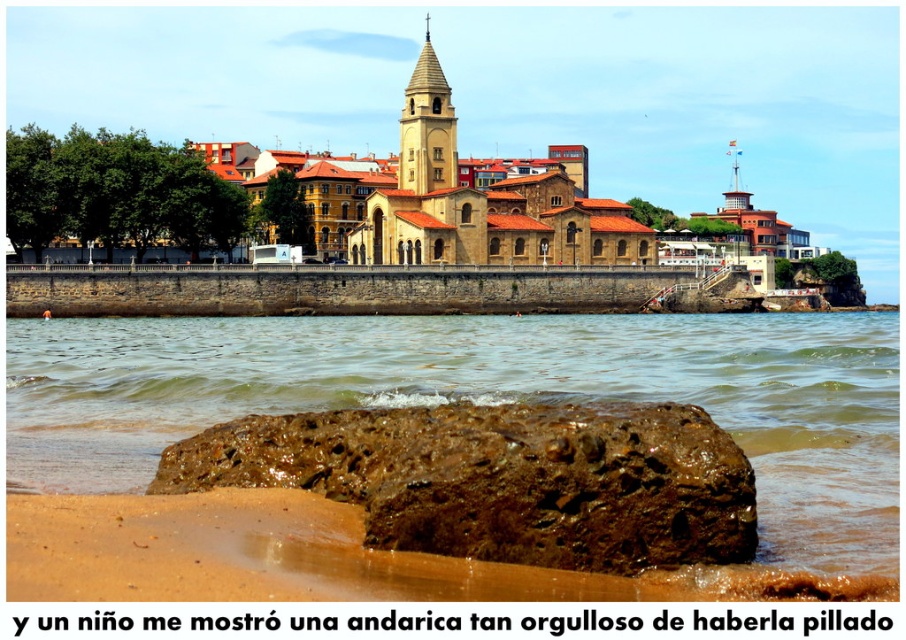
You are standing at the edge of the beach looking towards the historic church. Where exactly is the brown wet sand at lower center located in relation to your position?

The brown wet sand at lower center is located at point [487,396] relative to your position.

You are standing at the point with coordinates point (423, 64) and want to walk towards the point with coordinates point (58, 320). Based on the scene description, will you have to walk over the historic church or can you walk directly to your destination?

You can walk directly to the point (58, 320) without walking over the historic church because point (58, 320) is in front of point (423, 64), implying it is closer to the viewer and likely in the foreground where the sandy beach and shallow water are located, while the church is in the background.

You are a geologist examining the coastal area. You notice the brown rough rock at lower center and the smooth stone tower at upper center. Which of these two objects has a larger size according to the description?

The brown rough rock at lower center is bigger than the smooth stone tower at upper center, so the brown rough rock at lower center has a larger size.